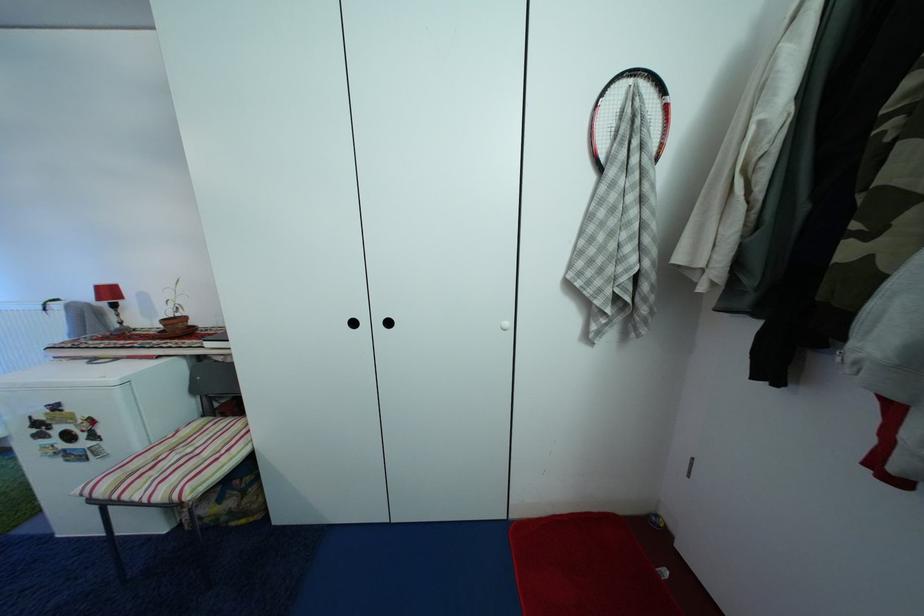
Which object does [176,323] point to?

This point indicates the terracotta plant pot.